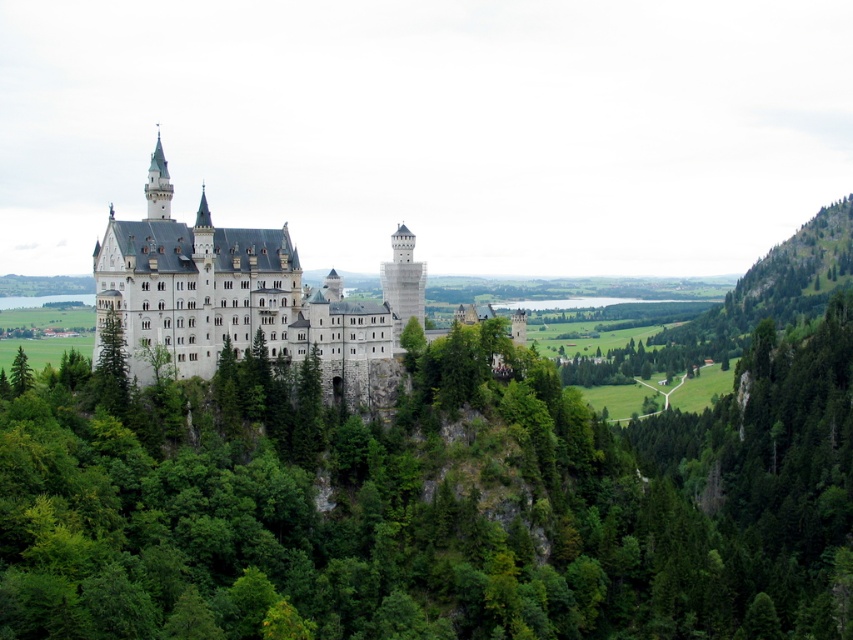
You are a tourist visiting Neuschwanstein Castle. You notice the white stone castle at center and the green leafy tree at left. Which one appears taller in the image?

The white stone castle at center is much taller than the green leafy tree at left.

You are a tourist standing at the base of the hill looking up at the white stone castle at center and the green leafy tree at left. Which object is higher in elevation?

The white stone castle at center is positioned over the green leafy tree at left, meaning it is higher in elevation.

You are a tourist standing at the base of the hill looking up at the white stone castle at center and the green leafy tree at left. Which object appears wider from your perspective?

The green leafy tree at left appears wider than the white stone castle at center because the white stone castle at center has a lesser width compared to green leafy tree at left.